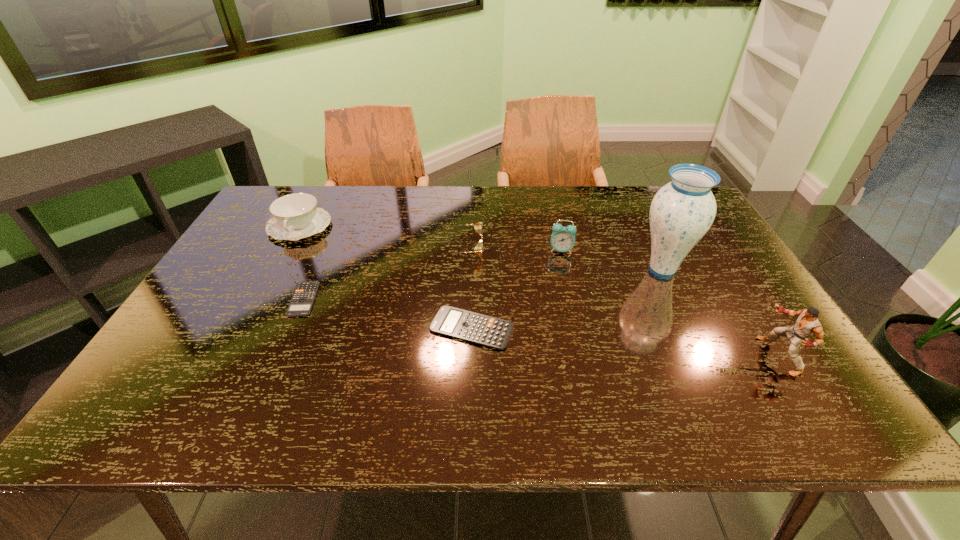
Find the location of a particular element. free space located on the front-facing side of the second tallest object is located at coordinates (615, 356).

Locate an element on the screen. Image resolution: width=960 pixels, height=540 pixels. object present at the far edge is located at coordinates (295, 216).

At what (x,y) coordinates should I click in order to perform the action: click on object situated at the near edge. Please return your answer as a coordinate pair (x, y). Looking at the image, I should click on (807, 325).

At what (x,y) coordinates should I click in order to perform the action: click on object that is at the left edge. Please return your answer as a coordinate pair (x, y). Looking at the image, I should click on (295, 216).

This screenshot has height=540, width=960. I want to click on vase located in the right edge section of the desktop, so click(x=682, y=211).

Where is `puncher at the right edge`? The height and width of the screenshot is (540, 960). puncher at the right edge is located at coordinates (807, 325).

Where is `object that is positioned at the far left corner`? object that is positioned at the far left corner is located at coordinates coord(295,216).

I want to click on object that is at the near right corner, so click(x=807, y=325).

This screenshot has height=540, width=960. I want to click on free location at the far edge of the desktop, so click(468, 209).

Where is `vacant space at the near edge of the desktop`? The height and width of the screenshot is (540, 960). vacant space at the near edge of the desktop is located at coordinates (448, 380).